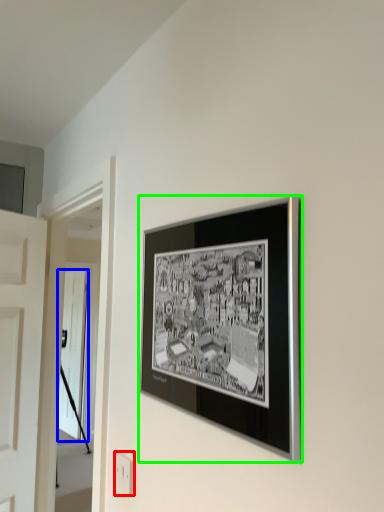
Question: Considering the real-world distances, which object is closest to electric outlet (highlighted by a red box)? door (highlighted by a blue box) or picture frame (highlighted by a green box).

Choices:
 (A) door
 (B) picture frame

Answer: (B)